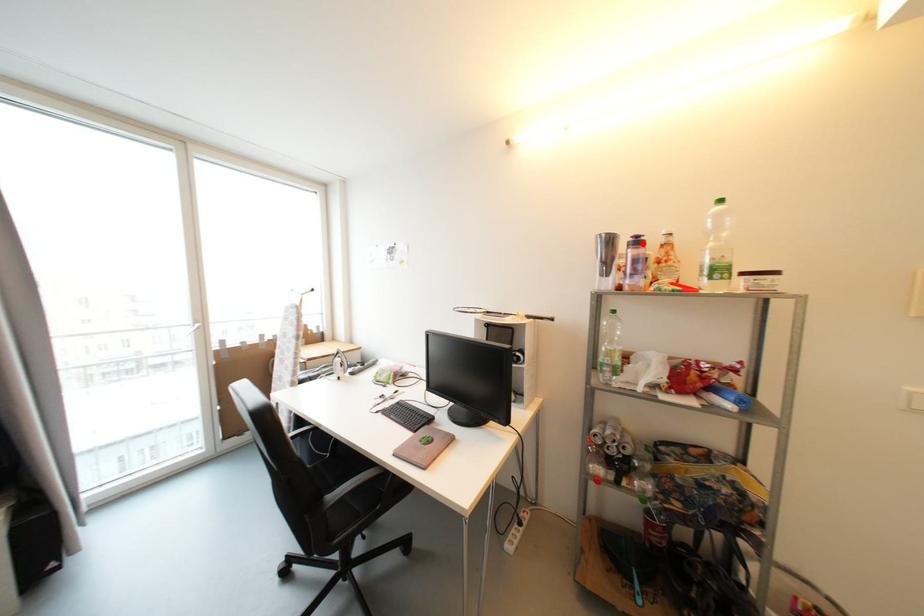
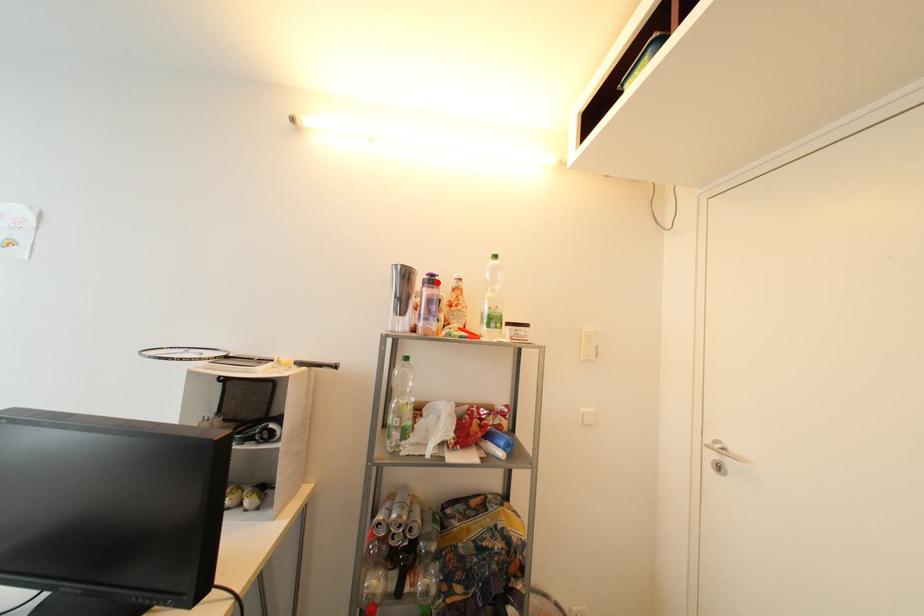
I am providing you with two images of the same scene from different viewpoints. A red point is marked on the first image and another point is marked on the second image. Are the points marked in image1 and image2 representing the same 3D position?

Yes